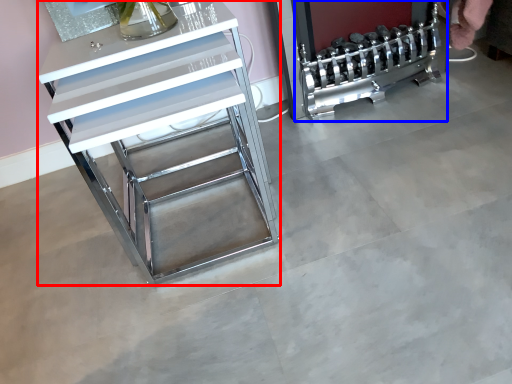
Question: Which object appears closest to the camera in this image, furniture (highlighted by a red box) or appliance (highlighted by a blue box)?

Choices:
 (A) furniture
 (B) appliance

Answer: (A)